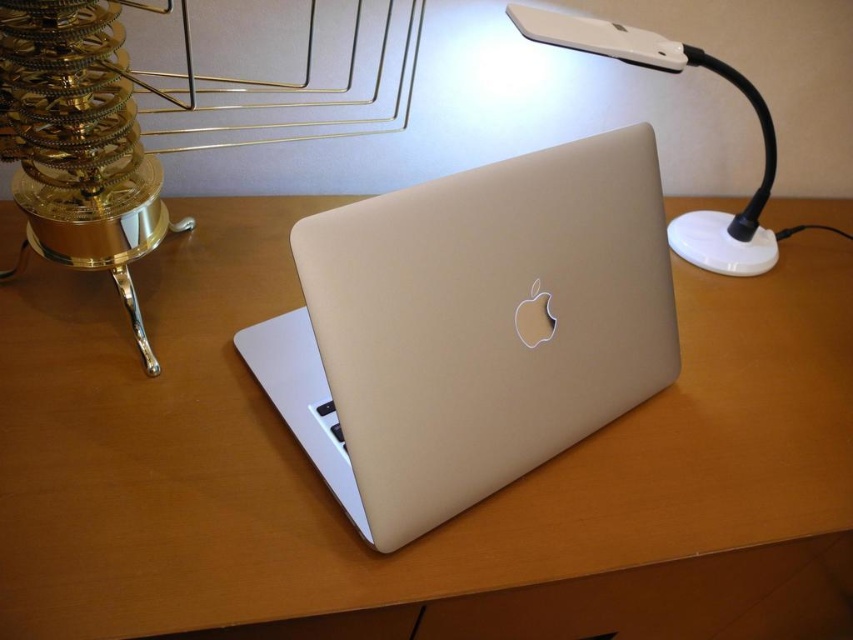
You are organizing a small event and need to place a 12x12 inch square decoration on the wooden table at center. Considering the size of the satin gold laptop at center already on the table, will there be enough space for the decoration?

The wooden table at center is larger in size than the satin gold laptop at center, so there should be enough space to place the 12x12 inch square decoration alongside the laptop.

You are organizing your desk and want to place a new item between the satin gold laptop at center and the white plastic lamp at upper right. Based on their positions, which object should the new item be closer to?

The new item should be closer to the white plastic lamp at upper right because the satin gold laptop at center is in front of it, meaning the lamp is further back.

You are looking at the workspace setup. There are two points marked on the desk surface. The first point is at coordinates point (433, 568) and the second point is at point (395, 337). Which point is closer to you?

Point (433, 568) is further to the camera than point (395, 337), so the point closer to you is point (395, 337).